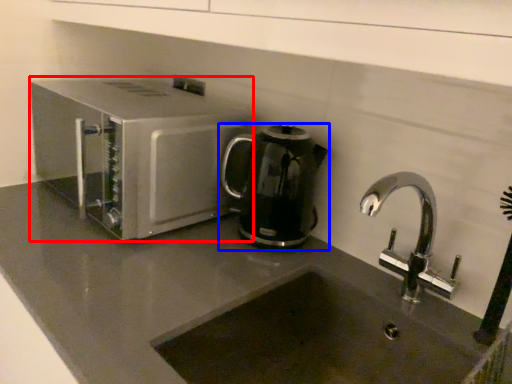
Question: Which of the following is the closest to the observer, home appliance (highlighted by a red box) or kitchen appliance (highlighted by a blue box)?

Choices:
 (A) home appliance
 (B) kitchen appliance

Answer: (A)